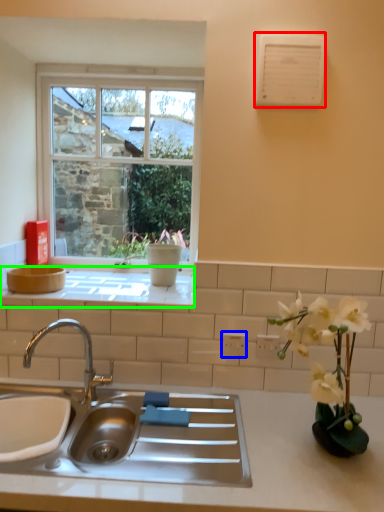
Question: Which object is the farthest from air conditioner (highlighted by a red box)? Choose among these: electric outlet (highlighted by a blue box) or window sill (highlighted by a green box).

Choices:
 (A) electric outlet
 (B) window sill

Answer: (A)